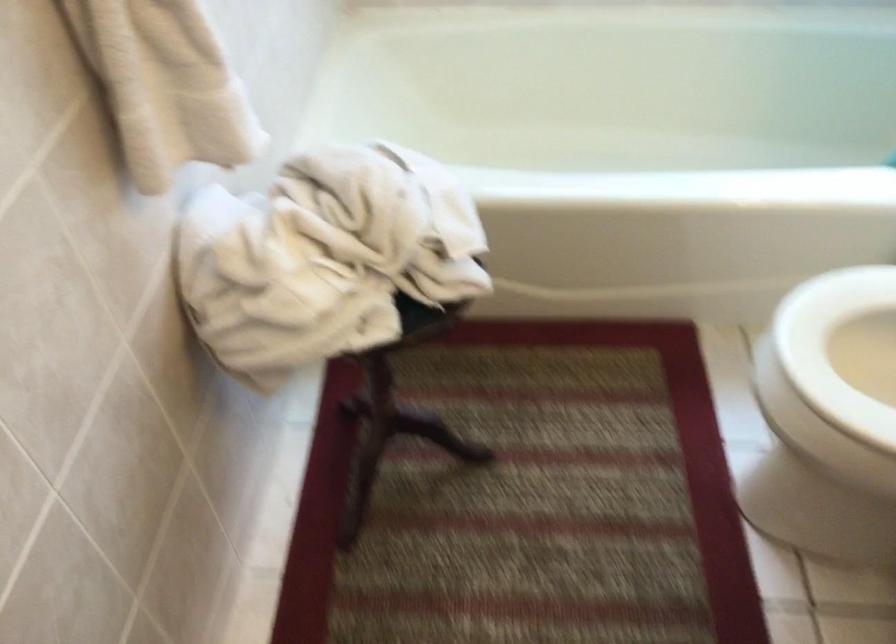
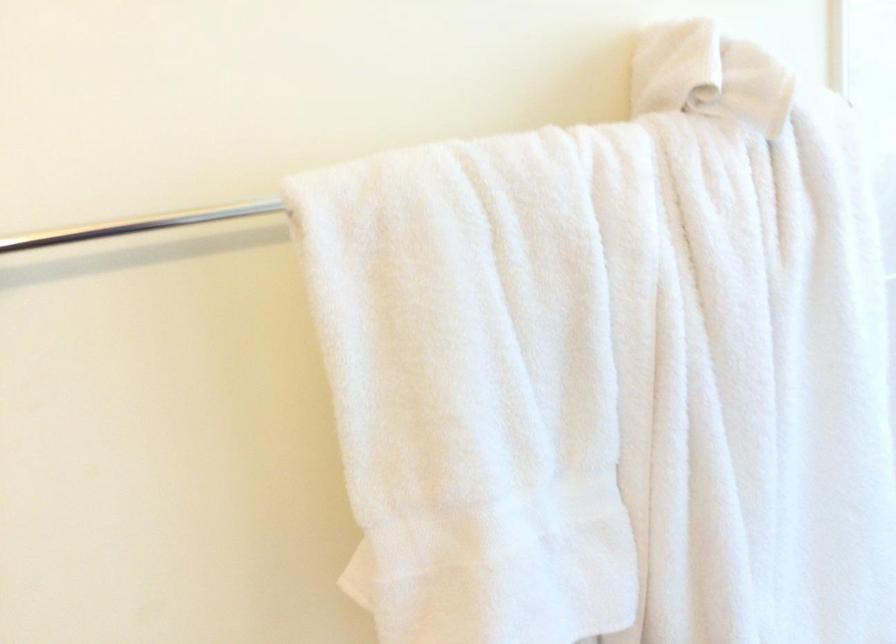
Question: The images are taken continuously from a first-person perspective. In which direction is your viewpoint rotating?

Choices:
 (A) Left
 (B) Right
 (C) Up
 (D) Down

Answer: (A)